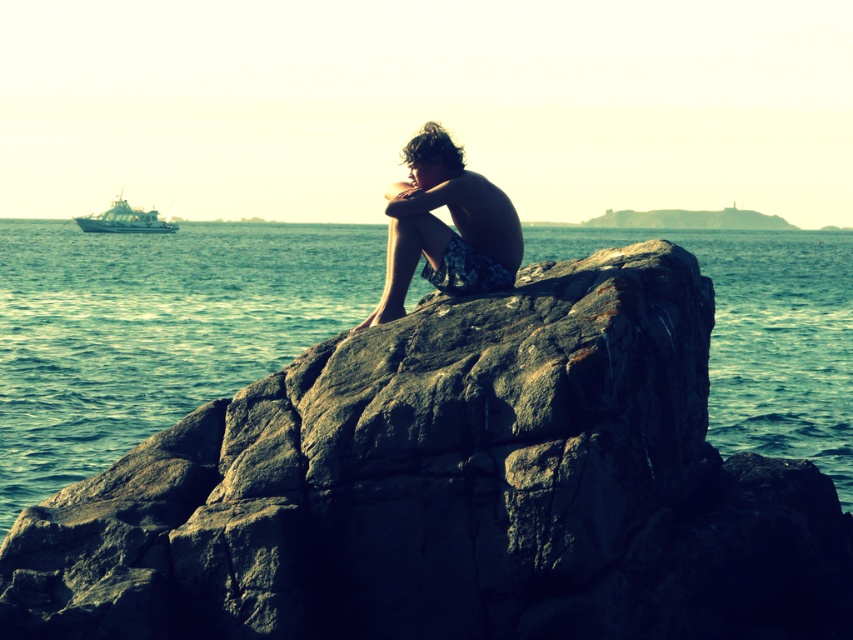
In the scene shown: Is floral shorts at center positioned before white matte boat at left?

That is True.

Consider the image. Is floral shorts at center bigger than white matte boat at left?

No.

Is point (379, 300) positioned in front of point (149, 225)?

Yes.

This screenshot has height=640, width=853. I want to click on floral shorts at center, so click(x=445, y=227).

What are the coordinates of `blue water at center` in the screenshot? It's located at (154, 330).

Can you confirm if blue water at center is taller than floral shorts at center?

Indeed, blue water at center has a greater height compared to floral shorts at center.

Is point (718, 323) positioned before point (428, 177)?

That is False.

You are a GUI agent. You are given a task and a screenshot of the screen. Output one action in this format:
    pyautogui.click(x=<x>, y=<y>)
    Task: Click on the blue water at center
    
    Given the screenshot: What is the action you would take?
    pyautogui.click(x=154, y=330)

Does blue water at center appear on the right side of white matte boat at left?

Yes, blue water at center is to the right of white matte boat at left.

Consider the image. Which is more to the right, blue water at center or white matte boat at left?

From the viewer's perspective, blue water at center appears more on the right side.

Where is `blue water at center`? blue water at center is located at coordinates (154, 330).